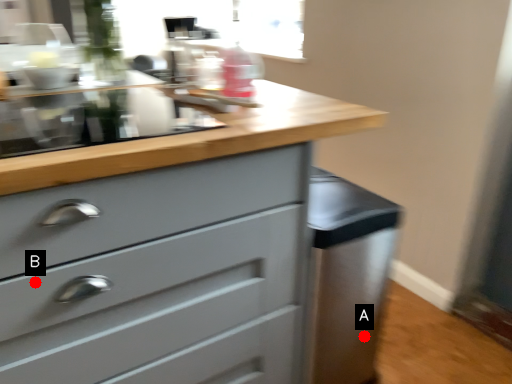
Question: Two points are circled on the image, labeled by A and B beside each circle. Among these points, which one is farthest from the camera?

Choices:
 (A) A is further
 (B) B is further

Answer: (A)